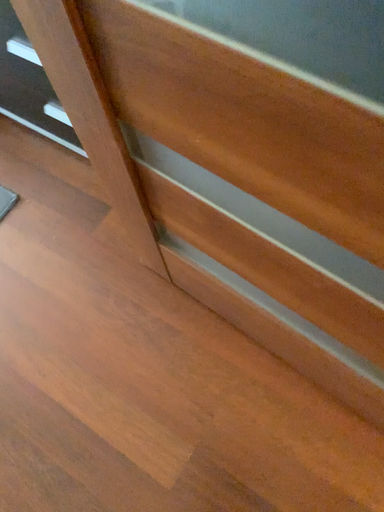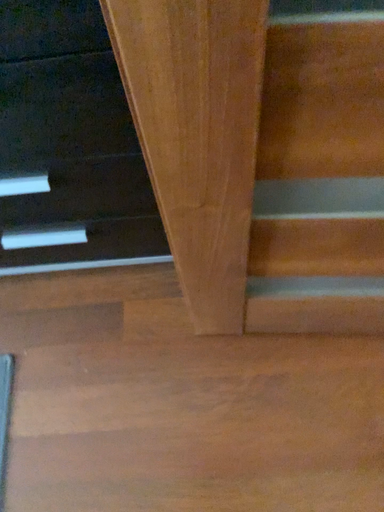
Question: How did the camera likely rotate when shooting the video?

Choices:
 (A) rotated left
 (B) rotated right

Answer: (B)